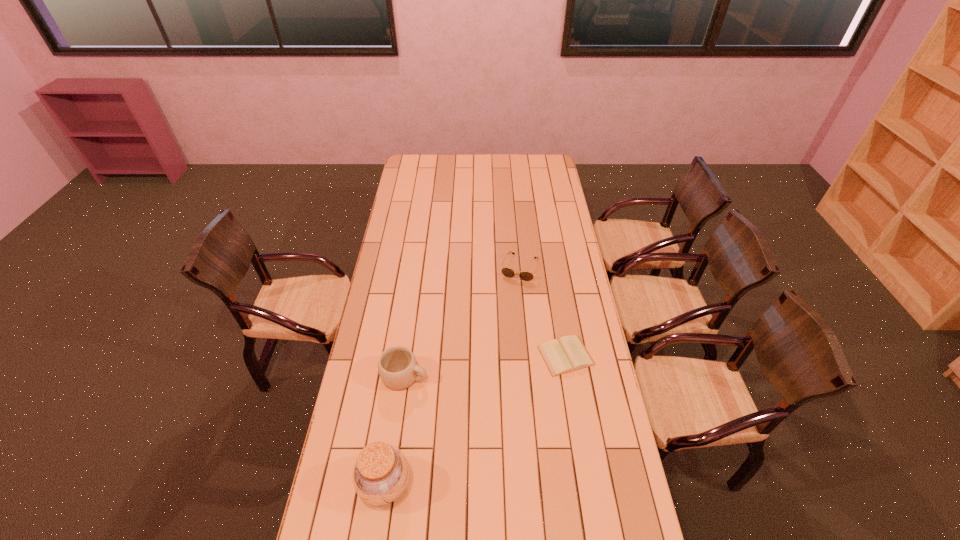
Identify the location of the tallest object. This screenshot has height=540, width=960. (381, 472).

Where is `the nearest object`? the nearest object is located at coordinates (381, 472).

Where is `diary`? diary is located at coordinates (569, 354).

I want to click on the third shortest object, so click(x=397, y=366).

This screenshot has width=960, height=540. I want to click on the second shortest object, so click(x=526, y=276).

Identify the location of sunglasses. The image size is (960, 540). (526, 276).

At what (x,y) coordinates should I click in order to perform the action: click on free space located 0.370m on the right of the nearest object. Please return your answer as a coordinate pair (x, y). This screenshot has width=960, height=540. Looking at the image, I should click on (531, 484).

Where is `free space located on the left of the shortest object`? Image resolution: width=960 pixels, height=540 pixels. free space located on the left of the shortest object is located at coordinates (484, 356).

This screenshot has height=540, width=960. What are the coordinates of `vacant space situated on the side of the third shortest object with the handle` in the screenshot? It's located at (447, 386).

Locate an element on the screen. vacant space located 0.140m on the side of the third shortest object with the handle is located at coordinates (463, 390).